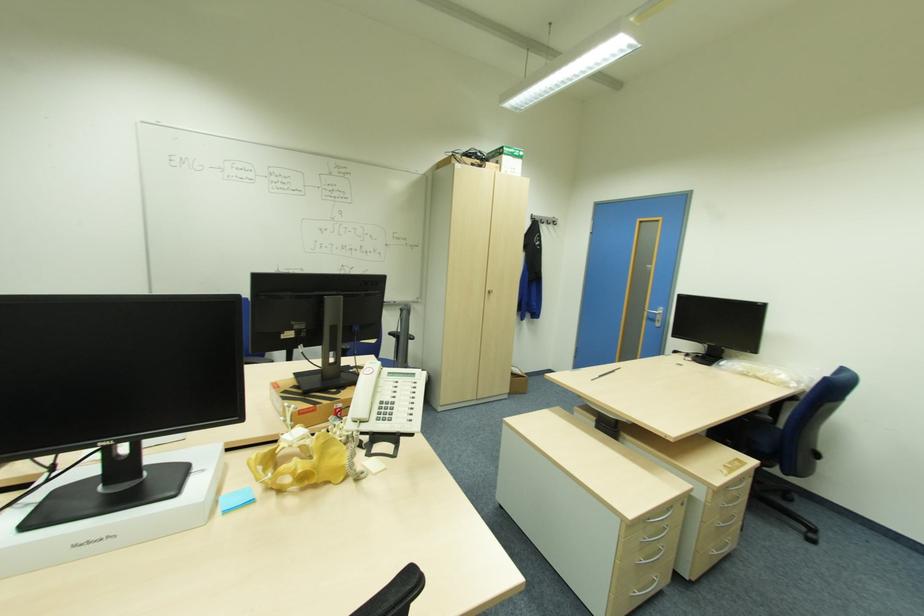
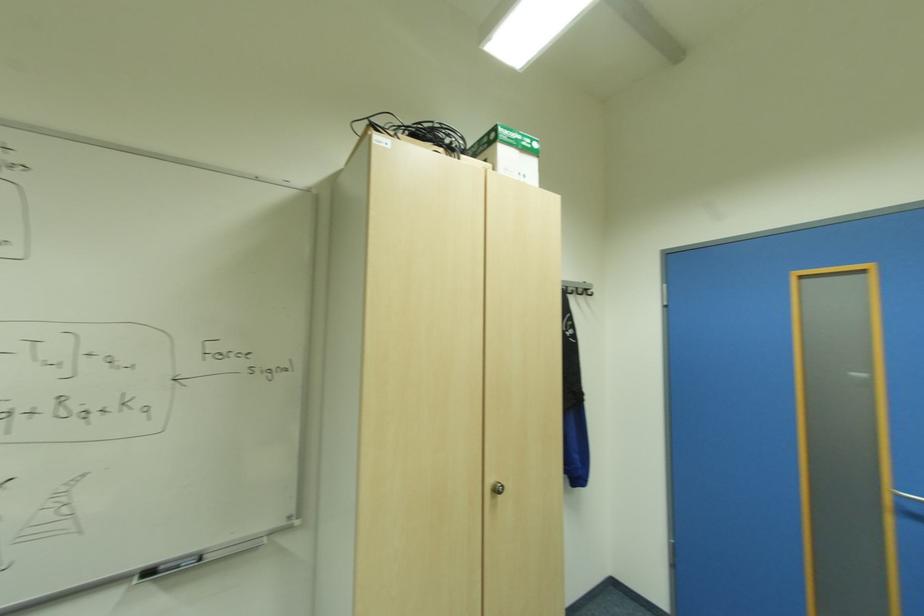
Where in the second image is the point corresponding to the point at 521,151 from the first image?

(533, 140)